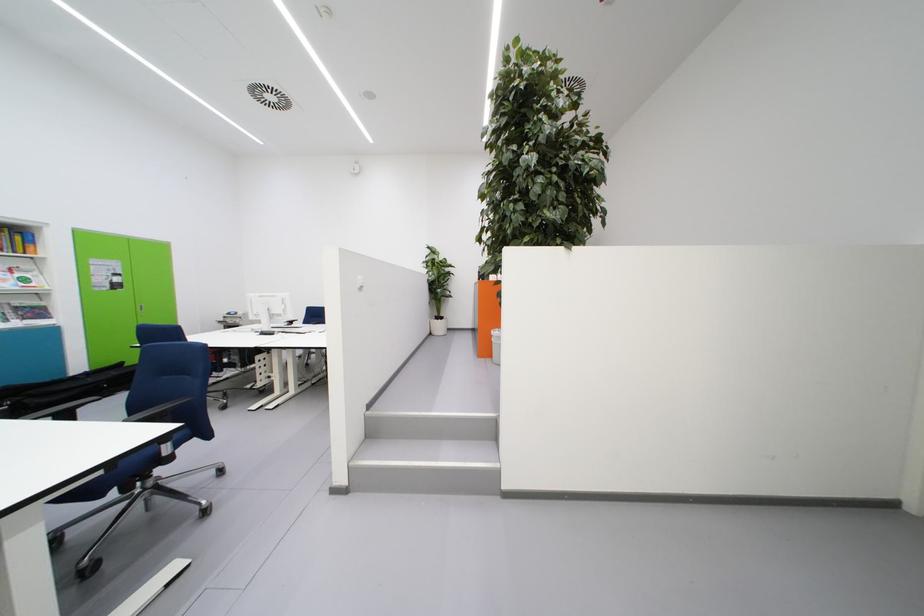
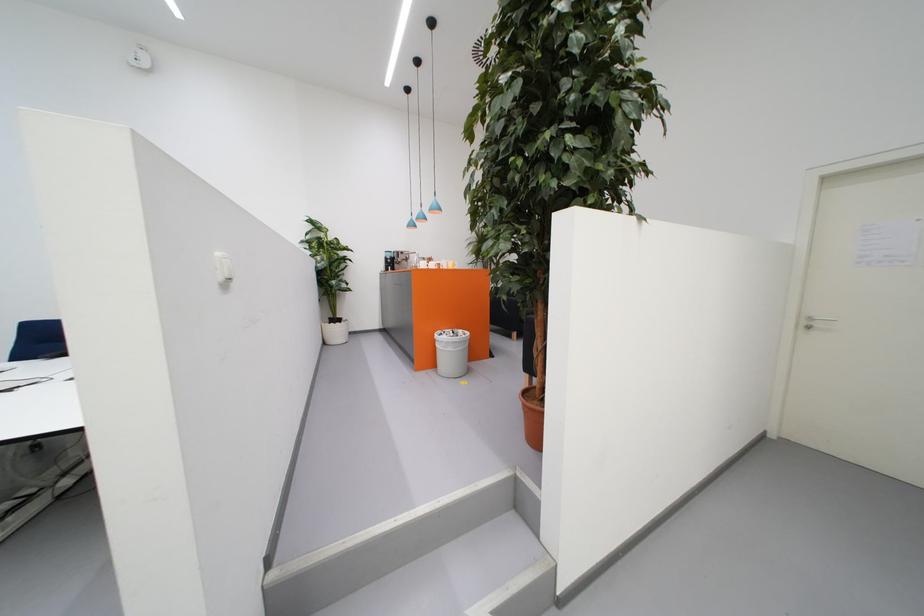
Locate, in the second image, the point that corresponds to point (445, 331) in the first image.

(344, 336)